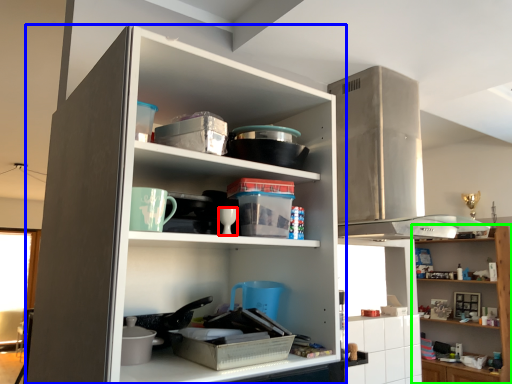
Question: Which object is positioned closest to tableware (highlighted by a red box)? Select from cupboard (highlighted by a blue box) and shelf (highlighted by a green box).

Choices:
 (A) cupboard
 (B) shelf

Answer: (A)